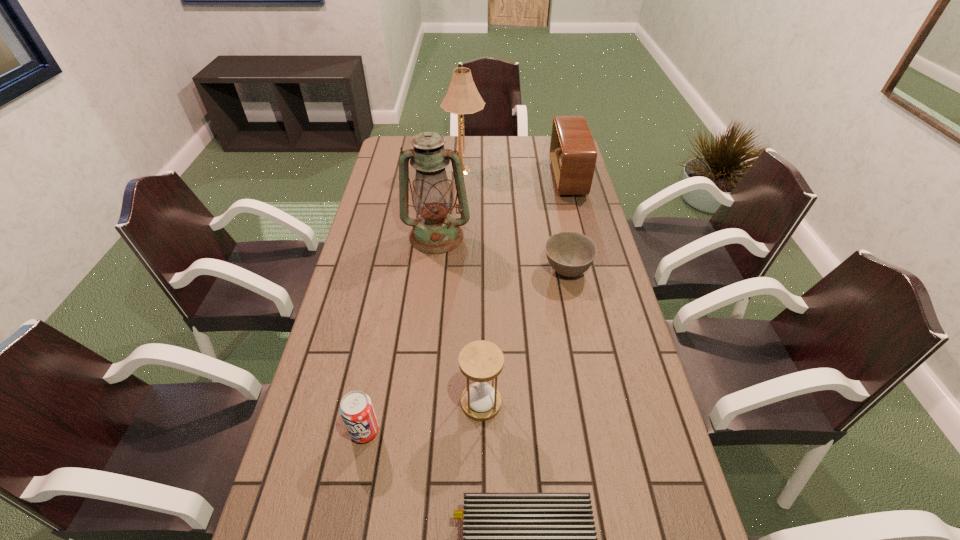
Where is `object present at the far right corner`? This screenshot has height=540, width=960. object present at the far right corner is located at coordinates (573, 154).

In the image, there is a desktop. Where is `vacant space at the far edge`? This screenshot has width=960, height=540. vacant space at the far edge is located at coordinates (493, 137).

The width and height of the screenshot is (960, 540). In the image, there is a desktop. What are the coordinates of `free space at the left edge` in the screenshot? It's located at (378, 320).

Identify the location of vacant space at the right edge of the desktop. (580, 216).

Find the location of `vacant area at the far left corner`. vacant area at the far left corner is located at coordinates 393,151.

This screenshot has width=960, height=540. I want to click on vacant space that's between the bowl and the hourglass, so click(524, 336).

Where is `empty location between the oil lamp and the radio receiver`? empty location between the oil lamp and the radio receiver is located at coordinates (502, 207).

Locate an element on the screen. Image resolution: width=960 pixels, height=540 pixels. vacant area that lies between the bowl and the hourglass is located at coordinates (524, 336).

Where is `free space between the soda can and the oil lamp`? Image resolution: width=960 pixels, height=540 pixels. free space between the soda can and the oil lamp is located at coordinates (400, 334).

Find the location of `free space that is in between the radio receiver and the lampshade`. free space that is in between the radio receiver and the lampshade is located at coordinates (516, 174).